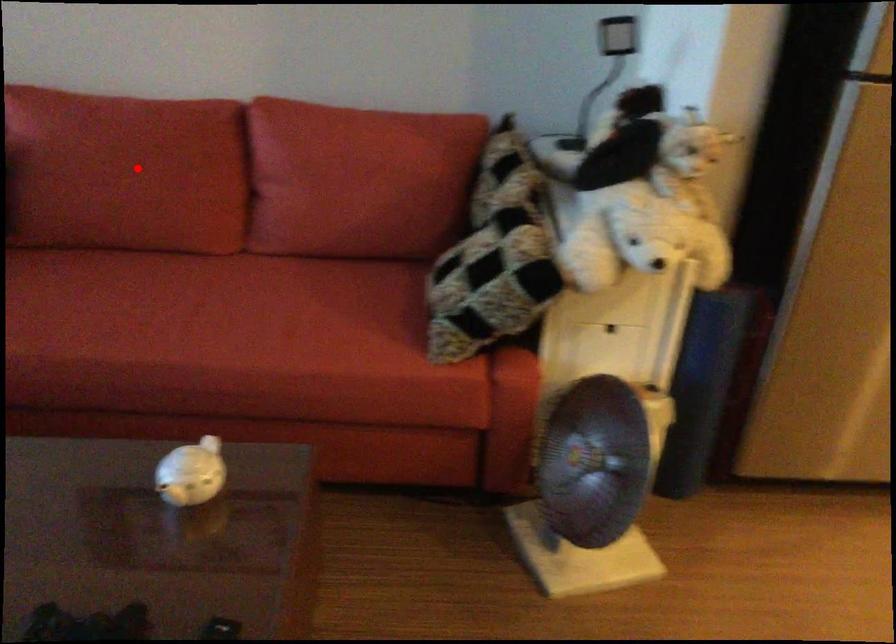
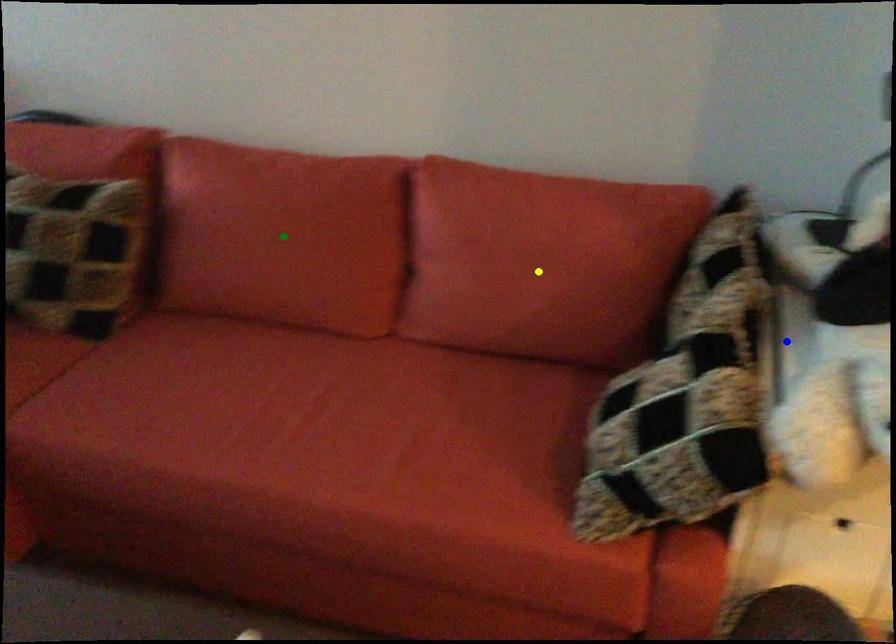
Question: I am providing you with two images of the same scene from different viewpoints. A red point is marked on the first image. You are given multiple points on the second image. Which point in image 2 is actually the same real-world point as the red point in image 1?

Choices:
 (A) yellow point
 (B) blue point
 (C) green point

Answer: (C)